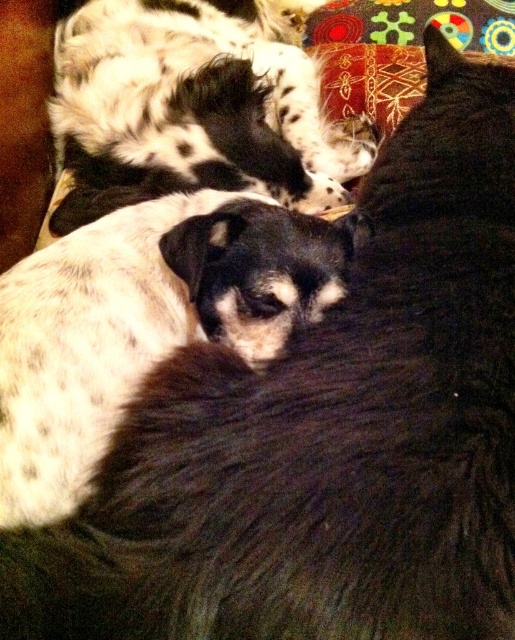
Image resolution: width=515 pixels, height=640 pixels. I want to click on spotted fur dog at center, so click(143, 323).

Consider the image. Which is below, spotted fur dog at center or spotted fur dog at upper left?

spotted fur dog at center

What are the coordinates of `spotted fur dog at center` in the screenshot? It's located at (143, 323).